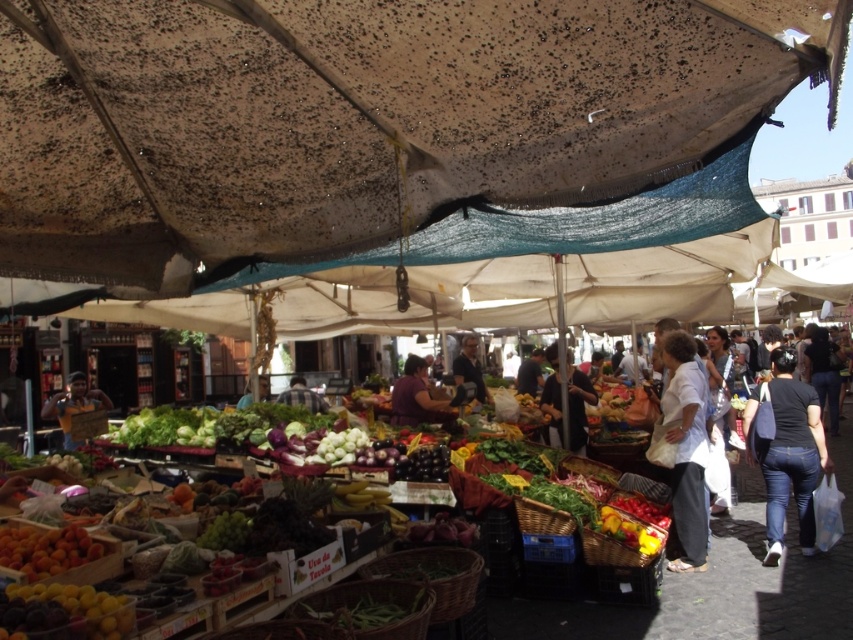
What are the coordinates of the brown fabric canopy at upper center?

The brown fabric canopy at upper center is located at point (x=358, y=118).

You are a customer at the market and want to pick up both the dark fabric bag at center and the smooth purple fabric at center. If you can carry both items at the same time, what is the minimum distance you need to move between them?

The minimum distance you need to move between the dark fabric bag at center and the smooth purple fabric at center is 5.16 meters.

Based on the photo, you are a customer at the market and want to buy the shiny orange peaches at lower left. You notice there is also a purple fabric at center. Which item is smaller in size?

The shiny orange peaches at lower left are smaller in size compared to the purple fabric at center.